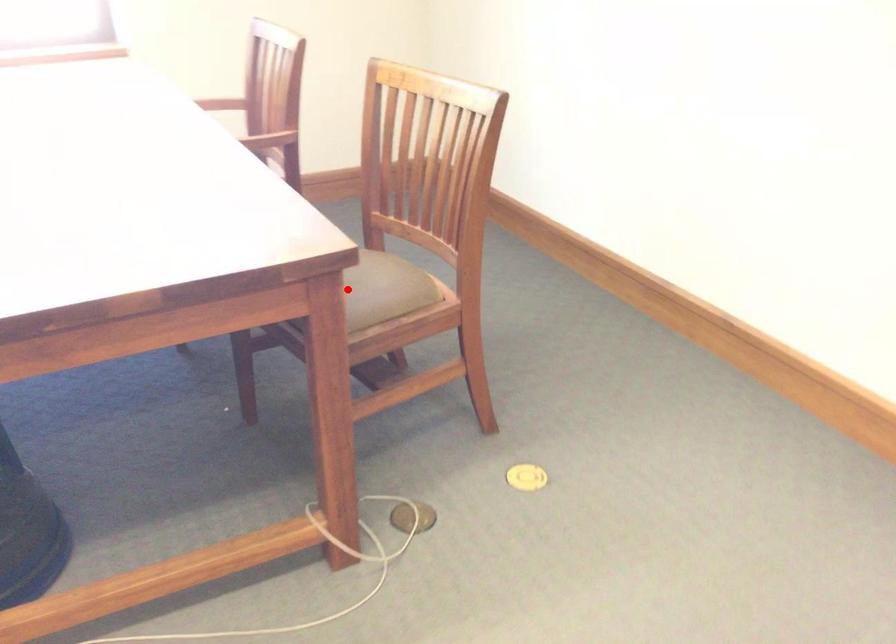
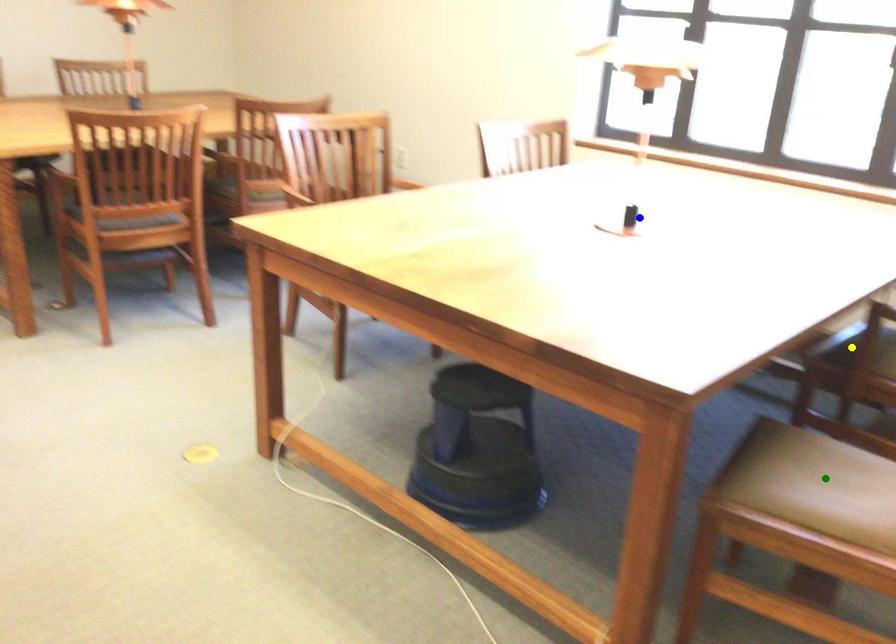
Question: I am providing you with two images of the same scene from different viewpoints. A red point is marked on the first image. You are given multiple points on the second image. Which point in image 2 represents the same 3d spot as the red point in image 1?

Choices:
 (A) yellow point
 (B) blue point
 (C) green point

Answer: (C)